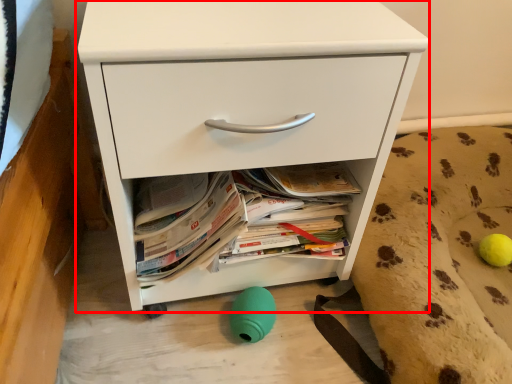
Question: From the image's perspective, what is the correct spatial relationship of chest of drawers (annotated by the red box) in relation to dog bed?

Choices:
 (A) below
 (B) above

Answer: (B)